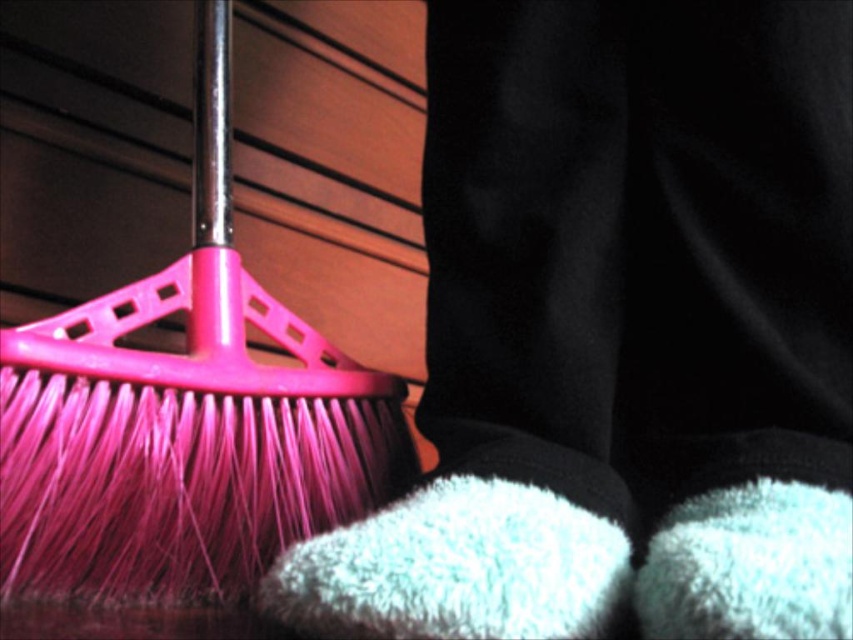
Question: Considering the relative positions of pink plastic brush at left and fuzzy white sock at lower center in the image provided, where is pink plastic brush at left located with respect to fuzzy white sock at lower center?

Choices:
 (A) below
 (B) above

Answer: (B)

Question: Which point appears closest to the camera in this image?

Choices:
 (A) (167, 451)
 (B) (419, 611)

Answer: (B)

Question: In this image, where is pink plastic brush at left located relative to fuzzy white sock at lower center?

Choices:
 (A) above
 (B) below

Answer: (A)

Question: Which point is closer to the camera?

Choices:
 (A) (215, 444)
 (B) (438, 568)

Answer: (B)

Question: Where is pink plastic brush at left located in relation to fuzzy white sock at lower center in the image?

Choices:
 (A) below
 (B) above

Answer: (B)